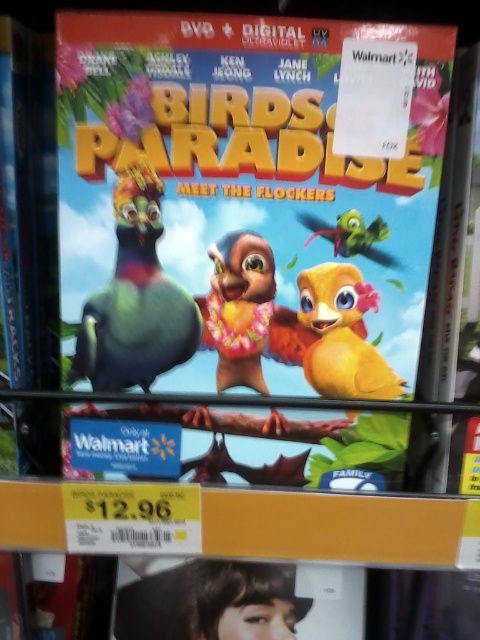
From the picture: You are designing a promotional poster for the movie and need to arrange the matte green bird at center and the yellow matte bird at center. According to the DVD cover, which bird should you make larger in size?

The matte green bird at center should be made larger in size than the yellow matte bird at center, as it is depicted as larger on the DVD cover.

You are looking at the DVD cover of the movie Birds of Paradise. There are two points on the cover, one at point coordinates (120, 202) and another at (315, 374). Which point is closer to you?

Point (120, 202) is closer to the viewer than point (315, 374).

What is the height comparison between the matte green bird at center and the green matte bird at upper center on the DVD cover?

The matte green bird at center is taller than the green matte bird at upper center.